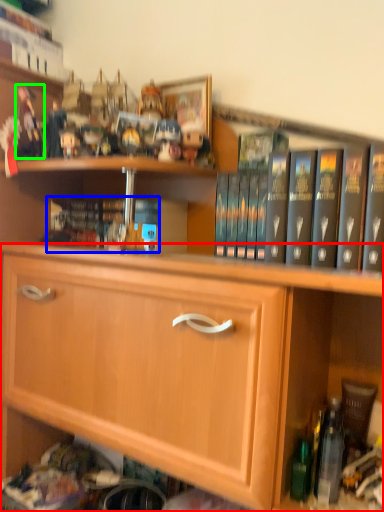
Question: Estimate the real-world distances between objects in this image. Which object is farther from cabinetry (highlighted by a red box), book (highlighted by a blue box) or toy (highlighted by a green box)?

Choices:
 (A) book
 (B) toy

Answer: (B)